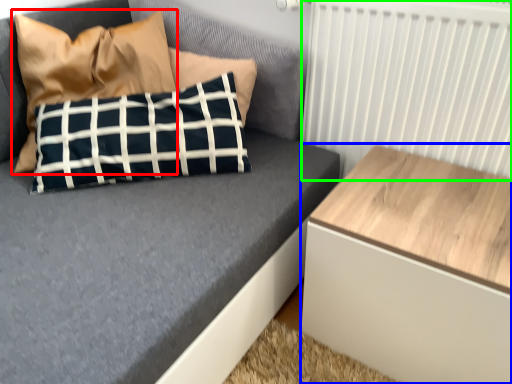
Question: Which object is positioned closest to pillow (highlighted by a red box)? Select from table (highlighted by a blue box) and radiator (highlighted by a green box).

Choices:
 (A) table
 (B) radiator

Answer: (B)